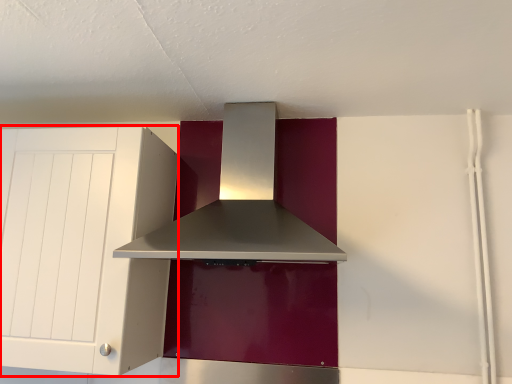
Question: From the image, what is the correct spatial relationship of cabinetry (annotated by the red box) in relation to home appliance?

Choices:
 (A) right
 (B) left

Answer: (B)